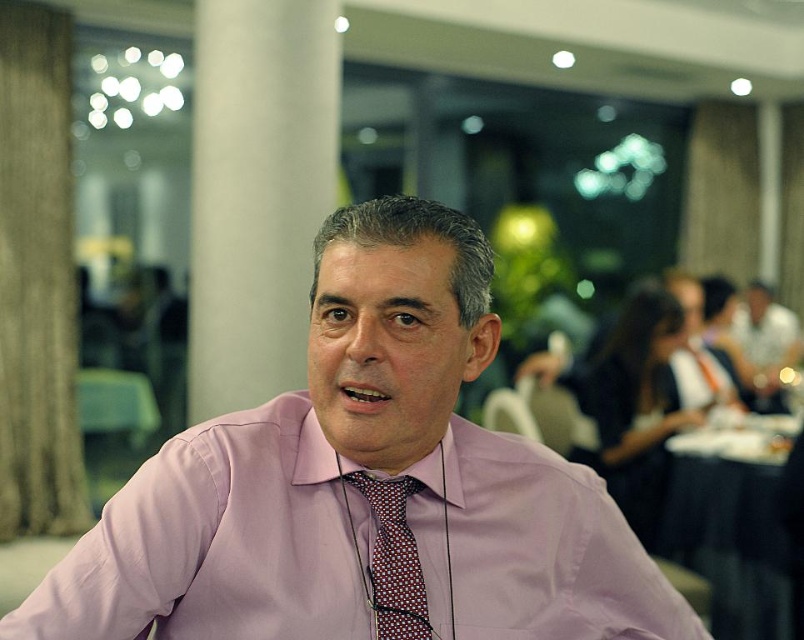
You are a photographer who wants to focus on the red dotted tie at center of the man in the image. Since the pink fabric shirt at center is in the way, can you adjust your camera to focus on the tie without moving the shirt?

The pink fabric shirt at center is closer to the viewer than the red dotted tie at center, so adjusting the camera focus to the tie might be possible as it is behind the shirt. However, the existing shallow depth of field might keep the shirt in focus while blurring the tie. You may need to adjust the aperture for a shallower focus to isolate the tie.

You are a photographer adjusting your camera to focus on the man in the scene. There are two points of interest marked in the image. The first point is at coordinates point (577, 531) and the second point is at coordinates point (790, 561). Which of these points is closer to the camera?

Point (577, 531) is in front of point (790, 561), so the first point is closer to the camera.

You are a photographer who wants to focus on the pink fabric shirt at center. The camera you are using has a focus point at coordinates point(367, 474). Will the focus point align with the pink fabric shirt at center?

The pink fabric shirt at center is located at point(367, 474), so the focus point will align with the pink fabric shirt at center.